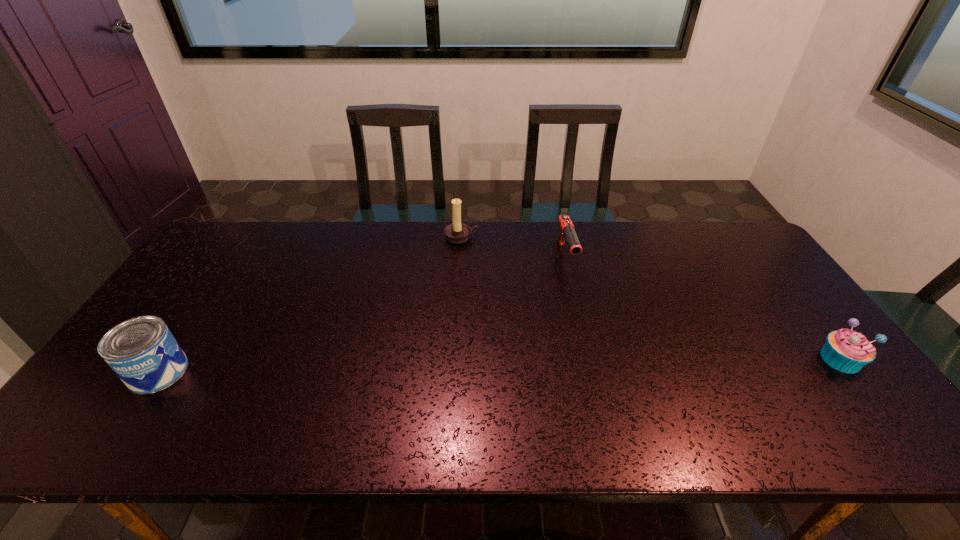
Identify the location of the leftmost object. 142,351.

The width and height of the screenshot is (960, 540). Find the location of `muffin`. muffin is located at coordinates (845, 350).

At what (x,y) coordinates should I click in order to perform the action: click on the tallest object. Please return your answer as a coordinate pair (x, y). Looking at the image, I should click on (457, 232).

Locate an element on the screen. The width and height of the screenshot is (960, 540). the second object from left to right is located at coordinates (457, 232).

In order to click on gun in this screenshot , I will do `click(566, 231)`.

The width and height of the screenshot is (960, 540). I want to click on free space located on the back of the rightmost object, so click(759, 255).

You are a GUI agent. You are given a task and a screenshot of the screen. Output one action in this format:
    pyautogui.click(x=<x>, y=<y>)
    Task: Click on the vacant area located on the wick of the tallest object
    This screenshot has width=960, height=540.
    Given the screenshot: What is the action you would take?
    pyautogui.click(x=482, y=326)

The width and height of the screenshot is (960, 540). I want to click on vacant area located 0.130m on the wick of the tallest object, so click(x=469, y=270).

Locate an element on the screen. free space located on the wick of the tallest object is located at coordinates click(470, 276).

I want to click on free region located at the aiming end of the gun, so click(576, 292).